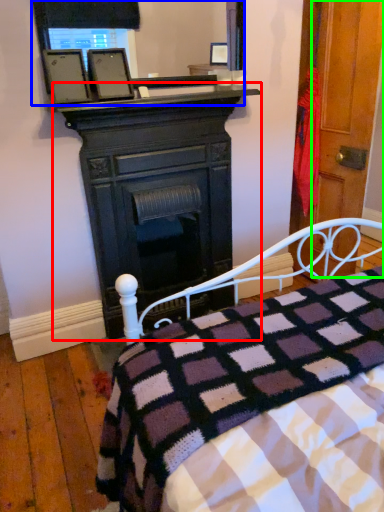
Question: Which is farther away from desk (highlighted by a red box)? mirror (highlighted by a blue box) or door (highlighted by a green box)?

Choices:
 (A) mirror
 (B) door

Answer: (B)